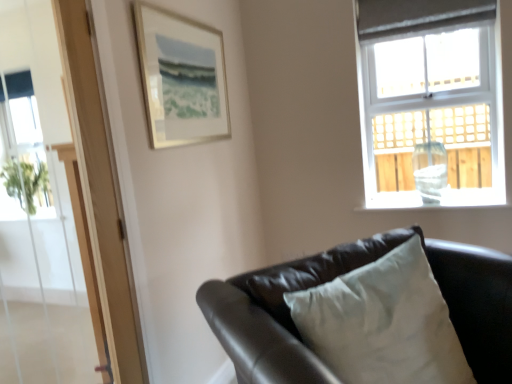
Question: Considering the relative sizes of matte black couch at lower right and transparent glass screen door at upper left in the image provided, is matte black couch at lower right bigger than transparent glass screen door at upper left?

Choices:
 (A) no
 (B) yes

Answer: (B)

Question: Is matte black couch at lower right smaller than transparent glass screen door at upper left?

Choices:
 (A) yes
 (B) no

Answer: (B)

Question: Does matte black couch at lower right have a lesser height compared to transparent glass screen door at upper left?

Choices:
 (A) yes
 (B) no

Answer: (A)

Question: Is transparent glass screen door at upper left completely or partially inside matte black couch at lower right?

Choices:
 (A) no
 (B) yes

Answer: (A)

Question: Does matte black couch at lower right turn towards transparent glass screen door at upper left?

Choices:
 (A) yes
 (B) no

Answer: (B)

Question: Choose the correct answer: Is clear glass door at left inside matte glass vase at upper right or outside it?

Choices:
 (A) inside
 (B) outside

Answer: (B)

Question: Based on their sizes in the image, would you say clear glass door at left is bigger or smaller than matte glass vase at upper right?

Choices:
 (A) small
 (B) big

Answer: (A)

Question: Considering the relative positions of clear glass door at left and matte glass vase at upper right in the image provided, is clear glass door at left to the left or to the right of matte glass vase at upper right?

Choices:
 (A) left
 (B) right

Answer: (A)

Question: In terms of width, does clear glass door at left look wider or thinner when compared to matte glass vase at upper right?

Choices:
 (A) wide
 (B) thin

Answer: (B)

Question: From the image's perspective, is clear glass door at left above or below matte black couch at lower right?

Choices:
 (A) above
 (B) below

Answer: (A)

Question: In terms of width, does clear glass door at left look wider or thinner when compared to matte black couch at lower right?

Choices:
 (A) thin
 (B) wide

Answer: (A)

Question: Considering the positions of clear glass door at left and matte black couch at lower right in the image, is clear glass door at left taller or shorter than matte black couch at lower right?

Choices:
 (A) short
 (B) tall

Answer: (B)

Question: Considering the relative positions of clear glass door at left and matte black couch at lower right in the image provided, is clear glass door at left to the left or to the right of matte black couch at lower right?

Choices:
 (A) right
 (B) left

Answer: (B)

Question: Considering the positions of point (359, 79) and point (202, 33), is point (359, 79) closer or farther from the camera than point (202, 33)?

Choices:
 (A) closer
 (B) farther

Answer: (B)

Question: Relative to silver metallic picture frame at upper left, is matte glass vase at upper right in front or behind?

Choices:
 (A) behind
 (B) front

Answer: (A)